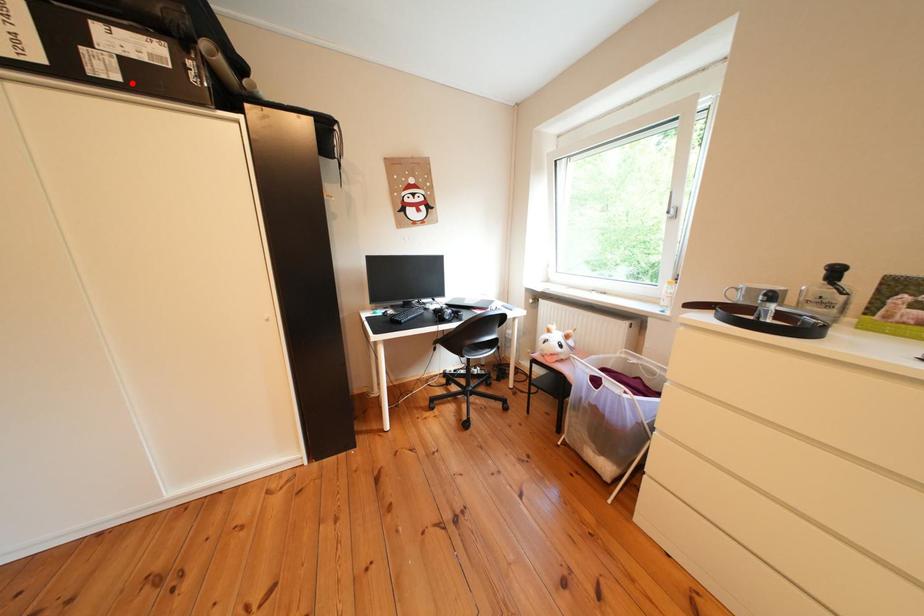
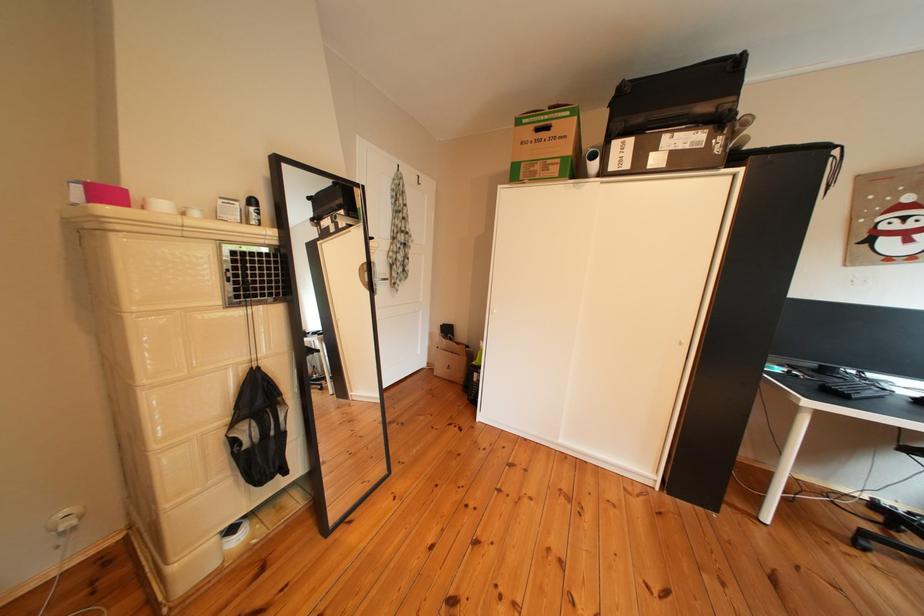
Where in the second image is the point corresponding to the highlighted location from the first image?

(676, 169)